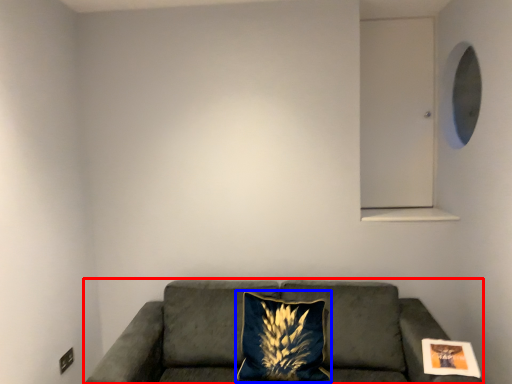
Question: Which object is closer to the camera taking this photo, studio couch (highlighted by a red box) or pillow (highlighted by a blue box)?

Choices:
 (A) studio couch
 (B) pillow

Answer: (A)